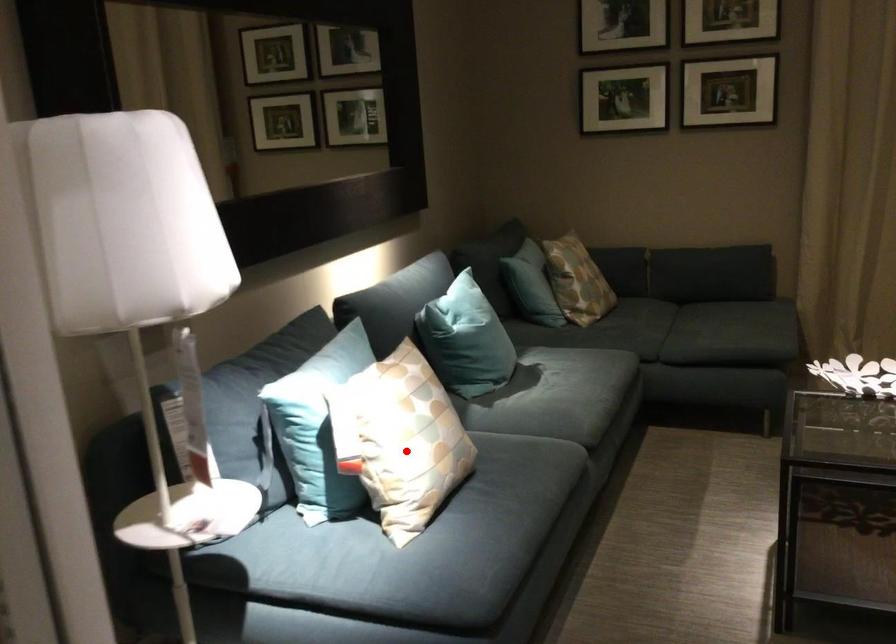
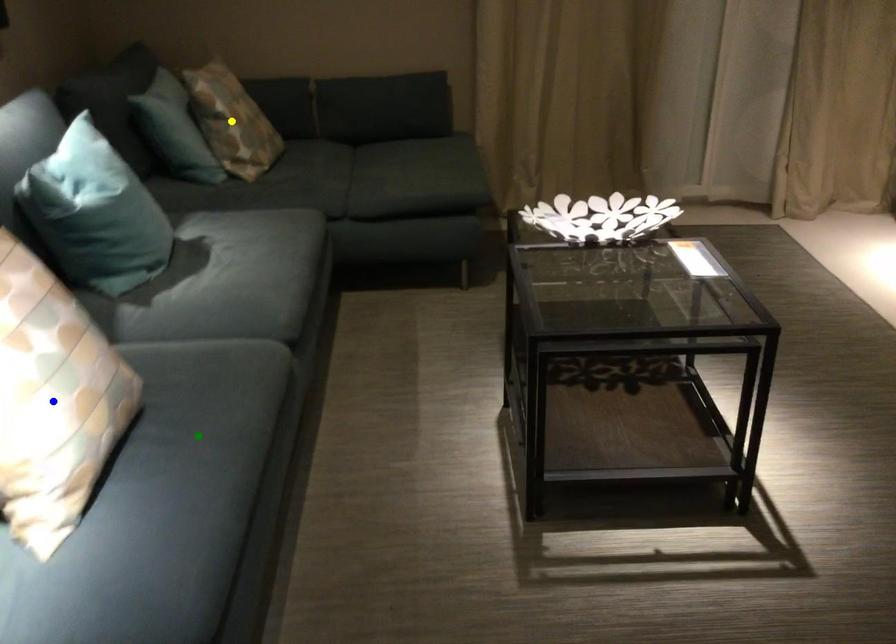
Question: I am providing you with two images of the same scene from different viewpoints. A red point is marked on the first image. You are given multiple points on the second image. Which point in image 2 represents the same 3d spot as the red point in image 1?

Choices:
 (A) yellow point
 (B) blue point
 (C) green point

Answer: (B)